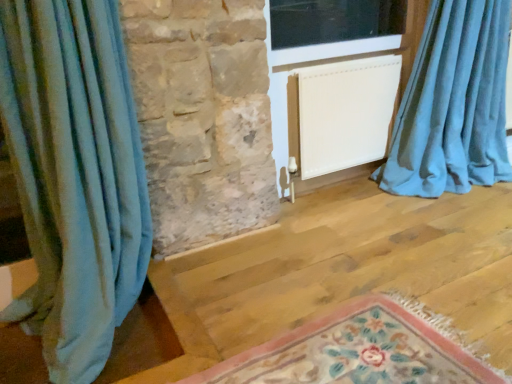
Question: Considering the relative sizes of floral rug at lower center and blue velvet curtain at right, which appears as the 2th curtain when viewed from the left, in the image provided, is floral rug at lower center smaller than blue velvet curtain at right, which appears as the 2th curtain when viewed from the left,?

Choices:
 (A) yes
 (B) no

Answer: (A)

Question: Can you confirm if floral rug at lower center is wider than blue velvet curtain at right, which ranks as the 1th curtain in right-to-left order?

Choices:
 (A) no
 (B) yes

Answer: (B)

Question: Does floral rug at lower center contain blue velvet curtain at right, which appears as the 2th curtain when viewed from the left?

Choices:
 (A) yes
 (B) no

Answer: (B)

Question: Does floral rug at lower center have a greater height compared to blue velvet curtain at right, which ranks as the 1th curtain in right-to-left order?

Choices:
 (A) no
 (B) yes

Answer: (A)

Question: Is floral rug at lower center thinner than blue velvet curtain at right, which appears as the 2th curtain when viewed from the left?

Choices:
 (A) yes
 (B) no

Answer: (B)

Question: Visually, is transparent glass window at upper center positioned to the left or to the right of floral rug at lower center?

Choices:
 (A) left
 (B) right

Answer: (B)

Question: Does point (304, 57) appear closer or farther from the camera than point (393, 322)?

Choices:
 (A) farther
 (B) closer

Answer: (A)

Question: Considering their positions, is transparent glass window at upper center located in front of or behind floral rug at lower center?

Choices:
 (A) front
 (B) behind

Answer: (B)

Question: From the image's perspective, relative to floral rug at lower center, is transparent glass window at upper center above or below?

Choices:
 (A) below
 (B) above

Answer: (B)

Question: Considering the positions of blue fabric curtain at left, which is counted as the second curtain, starting from the right, and floral rug at lower center in the image, is blue fabric curtain at left, which is counted as the second curtain, starting from the right, taller or shorter than floral rug at lower center?

Choices:
 (A) short
 (B) tall

Answer: (B)

Question: Is point (65, 119) closer or farther from the camera than point (420, 365)?

Choices:
 (A) closer
 (B) farther

Answer: (B)

Question: Is blue fabric curtain at left, which ranks as the 1th curtain in left-to-right order, to the left or to the right of floral rug at lower center in the image?

Choices:
 (A) right
 (B) left

Answer: (B)

Question: Is blue fabric curtain at left, which ranks as the 1th curtain in left-to-right order, in front of or behind floral rug at lower center in the image?

Choices:
 (A) behind
 (B) front

Answer: (A)

Question: From a real-world perspective, relative to white matte radiator at center, is transparent glass window at upper center vertically above or below?

Choices:
 (A) below
 (B) above

Answer: (B)

Question: Does point (287, 59) appear closer or farther from the camera than point (353, 109)?

Choices:
 (A) farther
 (B) closer

Answer: (B)